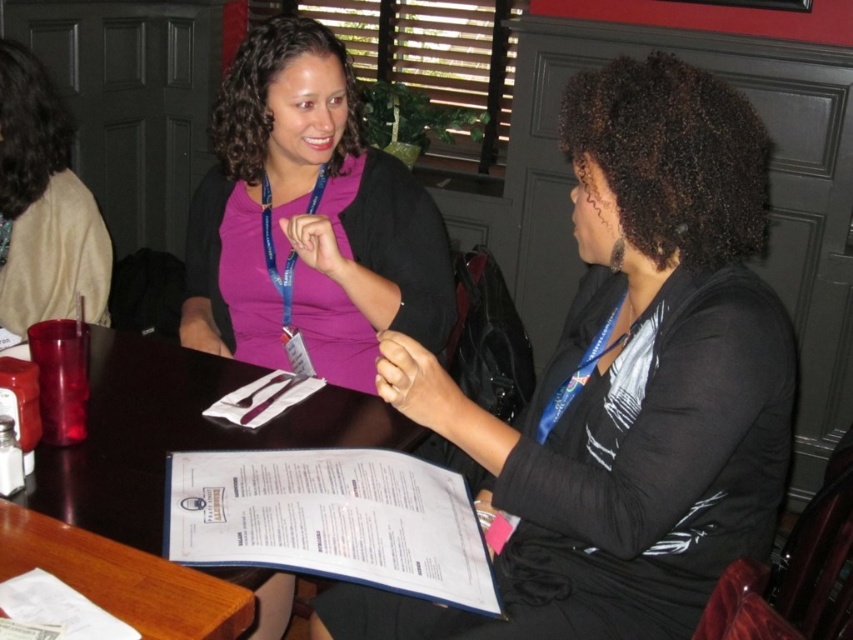
Question: Is white paper menu at center in front of wooden table at lower left?

Choices:
 (A) no
 (B) yes

Answer: (A)

Question: Is white paper menu at center to the left of beige fabric jacket at upper left from the viewer's perspective?

Choices:
 (A) yes
 (B) no

Answer: (B)

Question: Which of the following is the closest to the observer?

Choices:
 (A) wooden table at center
 (B) white paper menu at center

Answer: (B)

Question: Can you confirm if beige fabric jacket at upper left is thinner than wooden table at lower left?

Choices:
 (A) no
 (B) yes

Answer: (B)

Question: Which object is farther from the camera taking this photo?

Choices:
 (A) beige fabric jacket at upper left
 (B) matte black jacket at center

Answer: (A)

Question: Which object is farther from the camera taking this photo?

Choices:
 (A) white paper menu at center
 (B) beige fabric jacket at upper left
 (C) matte black jacket at center
 (D) wooden table at lower left

Answer: (B)